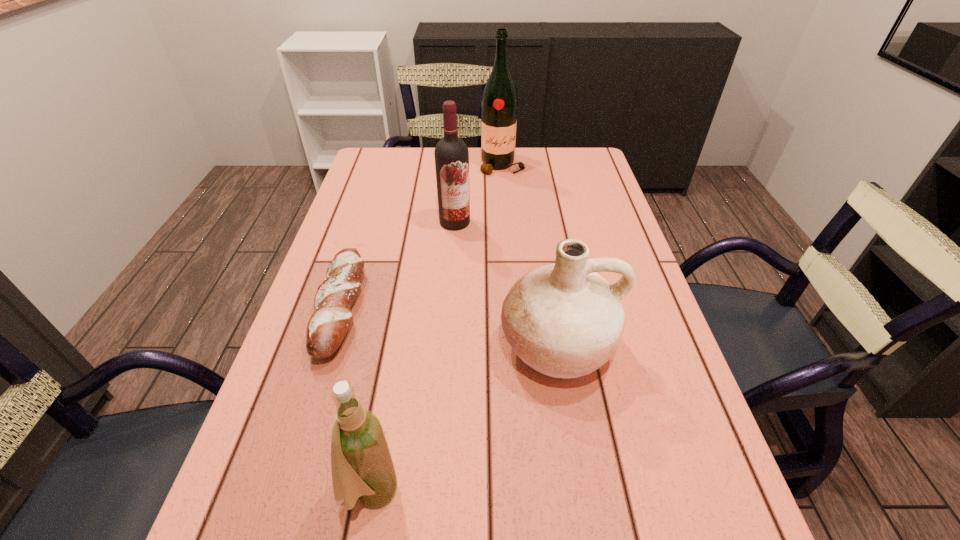
The image size is (960, 540). What are the coordinates of `free spot located on the label of the second wine bottle from left to right` in the screenshot? It's located at (446, 334).

Identify the location of vacant point located on the front-facing side of the second object from left to right. The width and height of the screenshot is (960, 540). (594, 491).

Identify the location of free spot located to pour from the handle of the pottery. The height and width of the screenshot is (540, 960). (583, 511).

This screenshot has height=540, width=960. What are the coordinates of `vacant area situated 0.150m on the front of the baguet` in the screenshot? It's located at (299, 441).

Find the location of a particular element. object that is at the far edge is located at coordinates (499, 101).

Locate an element on the screen. Image resolution: width=960 pixels, height=540 pixels. object located in the left edge section of the desktop is located at coordinates (327, 327).

The width and height of the screenshot is (960, 540). Identify the location of object that is at the right edge. (564, 320).

Locate an element on the screen. The image size is (960, 540). free space at the far edge is located at coordinates (497, 171).

Find the location of a particular element. The width and height of the screenshot is (960, 540). vacant region at the left edge of the desktop is located at coordinates (377, 293).

Where is `vacant space at the right edge of the desktop`? Image resolution: width=960 pixels, height=540 pixels. vacant space at the right edge of the desktop is located at coordinates (630, 244).